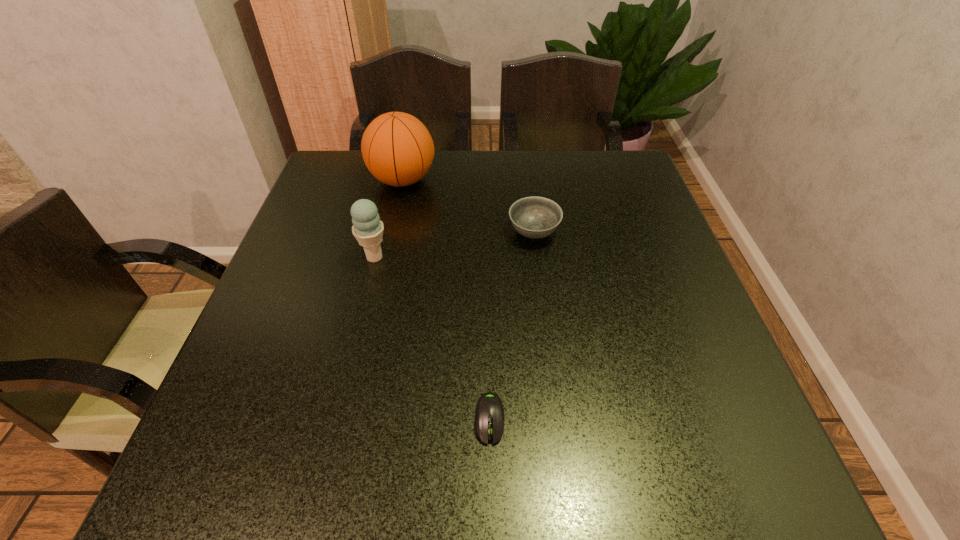
Identify the location of vacant area that lies between the tallest object and the second tallest object. (389, 219).

Select which object is the third closest to the rightmost object. Please provide its 2D coordinates. Your answer should be formatted as a tuple, i.e. [(x, y)], where the tuple contains the x and y coordinates of a point satisfying the conditions above.

[(489, 413)]

Select which object is the third closest to the shortest object. Please provide its 2D coordinates. Your answer should be formatted as a tuple, i.e. [(x, y)], where the tuple contains the x and y coordinates of a point satisfying the conditions above.

[(398, 150)]

What are the coordinates of `free space that satisfies the following two spatial constraints: 1. on the front side of the bowl; 2. on the right side of the farthest object` in the screenshot? It's located at (392, 232).